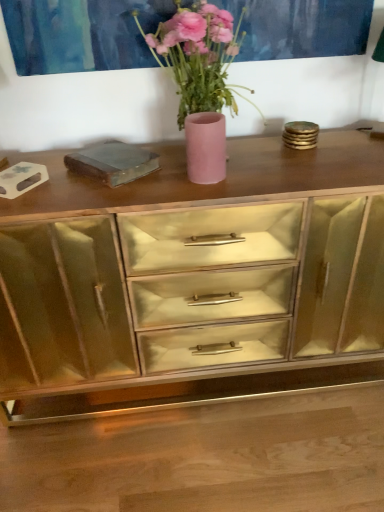
Question: Is matte pink vase at center shorter than gold mirrored cabinet at center?

Choices:
 (A) no
 (B) yes

Answer: (B)

Question: From a real-world perspective, is matte pink vase at center beneath gold mirrored cabinet at center?

Choices:
 (A) yes
 (B) no

Answer: (B)

Question: Can you confirm if matte pink vase at center is positioned to the left of gold mirrored cabinet at center?

Choices:
 (A) yes
 (B) no

Answer: (A)

Question: Is matte pink vase at center placed right next to gold mirrored cabinet at center?

Choices:
 (A) yes
 (B) no

Answer: (B)

Question: Is matte pink vase at center taller than gold mirrored cabinet at center?

Choices:
 (A) no
 (B) yes

Answer: (A)

Question: Considering the relative sizes of matte pink vase at center and gold mirrored cabinet at center in the image provided, is matte pink vase at center smaller than gold mirrored cabinet at center?

Choices:
 (A) no
 (B) yes

Answer: (B)

Question: Is pink matte vase at center turned away from gold mirrored cabinet at center?

Choices:
 (A) yes
 (B) no

Answer: (B)

Question: Is pink matte vase at center wider than gold mirrored cabinet at center?

Choices:
 (A) yes
 (B) no

Answer: (B)

Question: Considering the relative sizes of pink matte vase at center and gold mirrored cabinet at center in the image provided, is pink matte vase at center taller than gold mirrored cabinet at center?

Choices:
 (A) no
 (B) yes

Answer: (A)

Question: Can you confirm if pink matte vase at center is thinner than gold mirrored cabinet at center?

Choices:
 (A) no
 (B) yes

Answer: (B)

Question: Is pink matte vase at center oriented towards gold mirrored cabinet at center?

Choices:
 (A) yes
 (B) no

Answer: (B)

Question: Is pink matte vase at center closer to camera compared to gold mirrored cabinet at center?

Choices:
 (A) yes
 (B) no

Answer: (A)

Question: From a real-world perspective, is pink matte vase at center on top of matte pink vase at center?

Choices:
 (A) yes
 (B) no

Answer: (A)